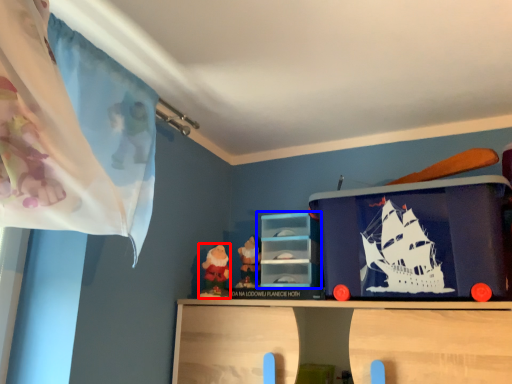
Question: Which object appears farthest to the camera in this image, toy (highlighted by a red box) or shelf (highlighted by a blue box)?

Choices:
 (A) toy
 (B) shelf

Answer: (A)